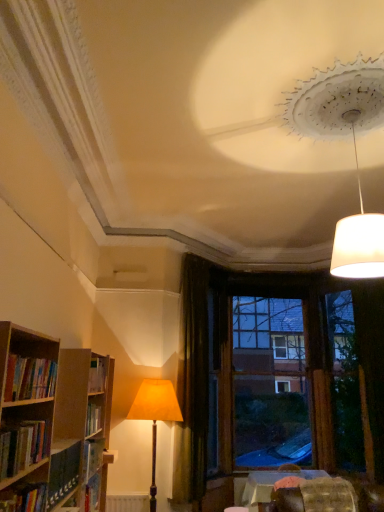
Question: Is brown wooden window frame at center at the left side of white matte lampshade at upper right, arranged as the second lamp when ordered from the bottom?

Choices:
 (A) yes
 (B) no

Answer: (B)

Question: Is brown wooden window frame at center turned away from white matte lampshade at upper right, arranged as the 2th lamp when viewed from the back?

Choices:
 (A) no
 (B) yes

Answer: (A)

Question: From the image's perspective, is brown wooden window frame at center above white matte lampshade at upper right, the second lamp viewed from the left?

Choices:
 (A) no
 (B) yes

Answer: (A)

Question: From a real-world perspective, is brown wooden window frame at center on top of white matte lampshade at upper right, the second lamp viewed from the left?

Choices:
 (A) yes
 (B) no

Answer: (B)

Question: Is brown wooden window frame at center smaller than white matte lampshade at upper right, the 1th lamp positioned from the right?

Choices:
 (A) yes
 (B) no

Answer: (B)

Question: Considering the relative positions of brown wooden window frame at center and white matte lampshade at upper right, arranged as the second lamp when ordered from the bottom, in the image provided, is brown wooden window frame at center in front of white matte lampshade at upper right, arranged as the second lamp when ordered from the bottom,?

Choices:
 (A) yes
 (B) no

Answer: (B)

Question: Is hardcover book at lower left, which ranks as the 1th book in bottom-to-top order, behind matte orange fabric lampshade at center, marked as the 1th lamp in a left-to-right arrangement?

Choices:
 (A) no
 (B) yes

Answer: (A)

Question: Is hardcover book at lower left, which ranks as the 1th book in bottom-to-top order, at the left side of matte orange fabric lampshade at center, which is counted as the second lamp, starting from the front?

Choices:
 (A) yes
 (B) no

Answer: (A)

Question: Considering the relative sizes of hardcover book at lower left, positioned as the third book in top-to-bottom order, and matte orange fabric lampshade at center, which is the first lamp in back-to-front order, in the image provided, is hardcover book at lower left, positioned as the third book in top-to-bottom order, shorter than matte orange fabric lampshade at center, which is the first lamp in back-to-front order,?

Choices:
 (A) yes
 (B) no

Answer: (A)

Question: Is hardcover book at lower left, which ranks as the 1th book in bottom-to-top order, in contact with matte orange fabric lampshade at center, acting as the 2th lamp starting from the top?

Choices:
 (A) no
 (B) yes

Answer: (A)

Question: Is hardcover book at lower left, which ranks as the 1th book in bottom-to-top order, thinner than matte orange fabric lampshade at center, the 1th lamp in the bottom-to-top sequence?

Choices:
 (A) yes
 (B) no

Answer: (A)

Question: Does hardcover book at lower left, positioned as the third book in top-to-bottom order, have a greater height compared to matte orange fabric lampshade at center, placed as the 2th lamp when sorted from right to left?

Choices:
 (A) yes
 (B) no

Answer: (B)

Question: Is textured fabric swivel chair at lower right outside brown wooden window frame at center?

Choices:
 (A) yes
 (B) no

Answer: (A)